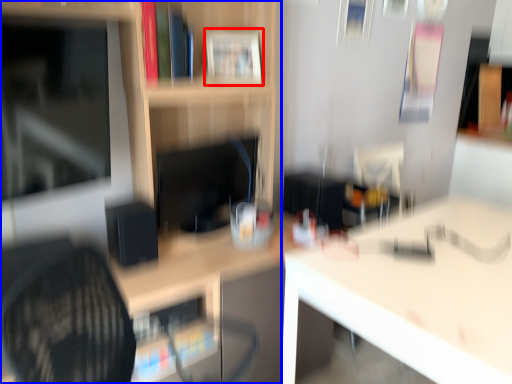
Question: Which object is closer to the camera taking this photo, book (highlighted by a red box) or shelf (highlighted by a blue box)?

Choices:
 (A) book
 (B) shelf

Answer: (B)